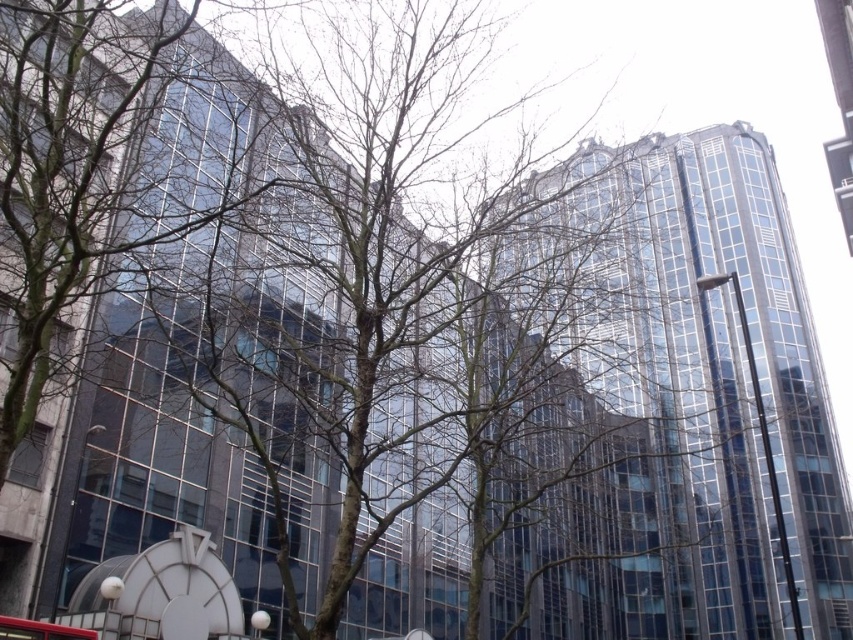
You are standing in front of the two large modern glass buildings. You notice a point marked at coordinates point [178,589]. What object is located at that point?

The point [178,589] corresponds to the white glossy clock at lower left.

You are standing at the corner of the street and see the white glossy clock at lower left and the red rubber bus at center. Which object appears taller in the image?

The white glossy clock at lower left appears taller than the red rubber bus at center because it has a greater height compared to the red rubber bus at center.